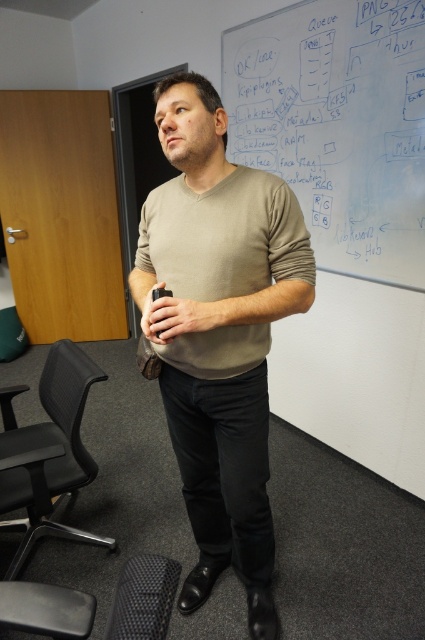
Question: Which of these objects is positioned farthest from the beige soft cotton shirt at center?

Choices:
 (A) matte black cup at center
 (B) beige cotton sweater at center
 (C) white chalkboard at upper center
 (D) black mesh swivel chair at lower left

Answer: (C)

Question: Does beige cotton sweater at center have a greater width compared to matte black remote at center?

Choices:
 (A) yes
 (B) no

Answer: (A)

Question: Is the position of white chalkboard at upper center more distant than that of black mesh swivel chair at lower left?

Choices:
 (A) yes
 (B) no

Answer: (A)

Question: Does white chalkboard at upper center have a greater width compared to beige soft cotton shirt at center?

Choices:
 (A) no
 (B) yes

Answer: (B)

Question: Which point is farther to the camera?

Choices:
 (A) (220, 116)
 (B) (207, 320)
 (C) (70, 452)

Answer: (C)

Question: Based on their relative distances, which object is farther from the beige cotton sweater at center?

Choices:
 (A) beige soft cotton shirt at center
 (B) matte black remote at center
 (C) black mesh swivel chair at lower left

Answer: (C)